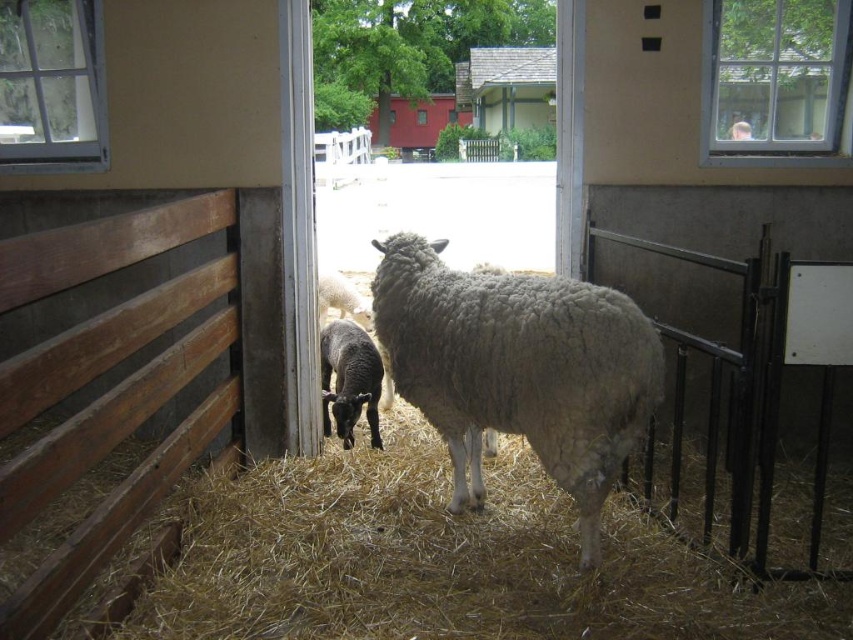
You are a farmer checking the barn. You see the light brown straw at center and the black woolly lamb at center. Which one is taller?

The black woolly lamb at center is taller than the light brown straw at center.

From the picture: You are a farmer who needs to separate two lambs for feeding. The black woolly lamb at center and the white woolen lamb at center are in the barn. Can you fit a 1.2 meter wide feeding trough between them without moving the lambs?

The black woolly lamb at center and white woolen lamb at center are 1.32 meters apart. Since the distance between them is 1.32 meters, which is greater than the 1.2 meter width of the feeding trough, you can place the trough between them without needing to move the lambs.